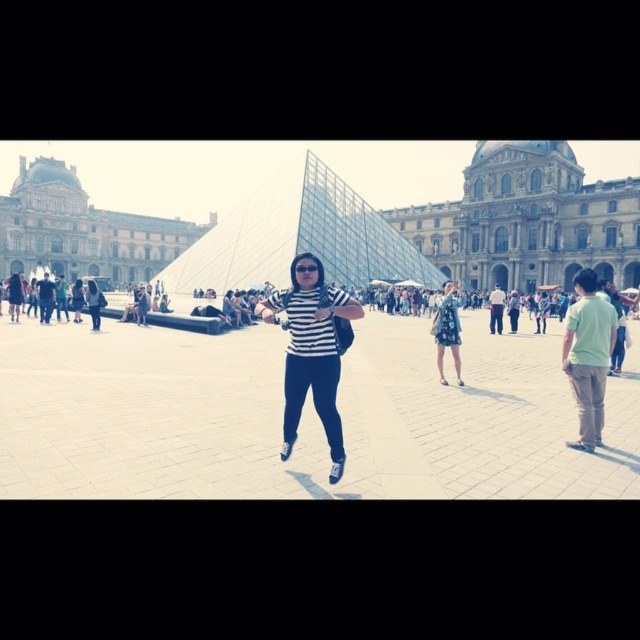
Which of these two, stone facade building at center or striped fabric at center, stands taller?

stone facade building at center

The height and width of the screenshot is (640, 640). I want to click on stone facade building at center, so click(x=528, y=220).

Does stone facade building at center have a smaller size compared to beige stone building at upper left?

Indeed, stone facade building at center has a smaller size compared to beige stone building at upper left.

Between stone facade building at center and beige stone building at upper left, which one has more height?

beige stone building at upper left is taller.

At what (x,y) coordinates should I click in order to perform the action: click on stone facade building at center. Please return your answer as a coordinate pair (x, y). This screenshot has width=640, height=640. Looking at the image, I should click on (528, 220).

Is point (134, 227) in front of point (448, 342)?

No.

Between beige stone building at upper left and blue floral dress at center, which one has less height?

Standing shorter between the two is blue floral dress at center.

Is point (200, 228) behind point (458, 372)?

Yes, point (200, 228) is farther from viewer.

You are a GUI agent. You are given a task and a screenshot of the screen. Output one action in this format:
    pyautogui.click(x=<x>, y=<y>)
    Task: Click on the beige stone building at upper left
    Image resolution: width=640 pixels, height=640 pixels.
    Given the screenshot: What is the action you would take?
    pyautogui.click(x=83, y=230)